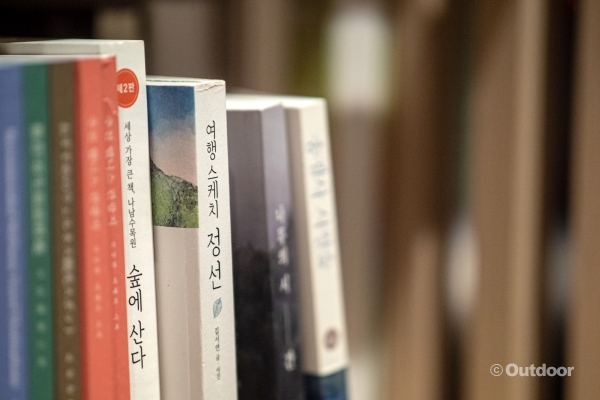
This screenshot has width=600, height=400. I want to click on books, so click(12, 296), click(40, 294), click(71, 287), click(101, 281), click(120, 288), click(133, 247), click(199, 224), click(268, 192), click(309, 187).